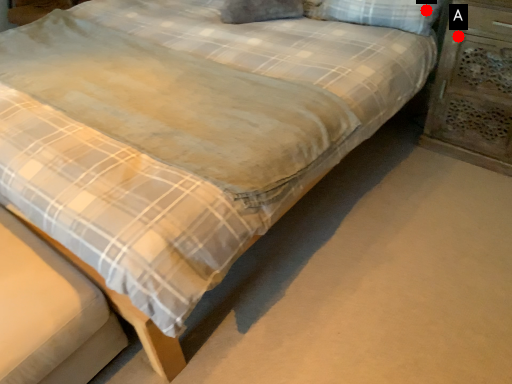
Question: Two points are circled on the image, labeled by A and B beside each circle. Which point is closer to the camera taking this photo?

Choices:
 (A) A is closer
 (B) B is closer

Answer: (A)